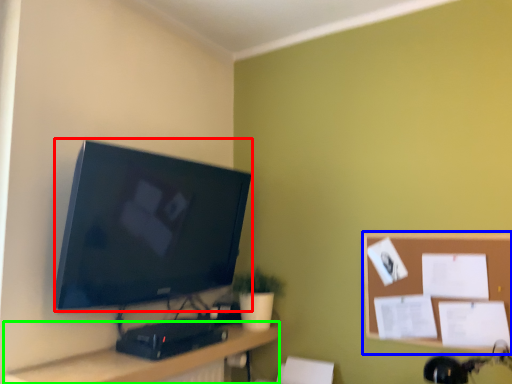
Question: Estimate the real-world distances between objects in this image. Which object is farther from television (highlighted by a red box), bulletin board (highlighted by a blue box) or desk (highlighted by a green box)?

Choices:
 (A) bulletin board
 (B) desk

Answer: (A)